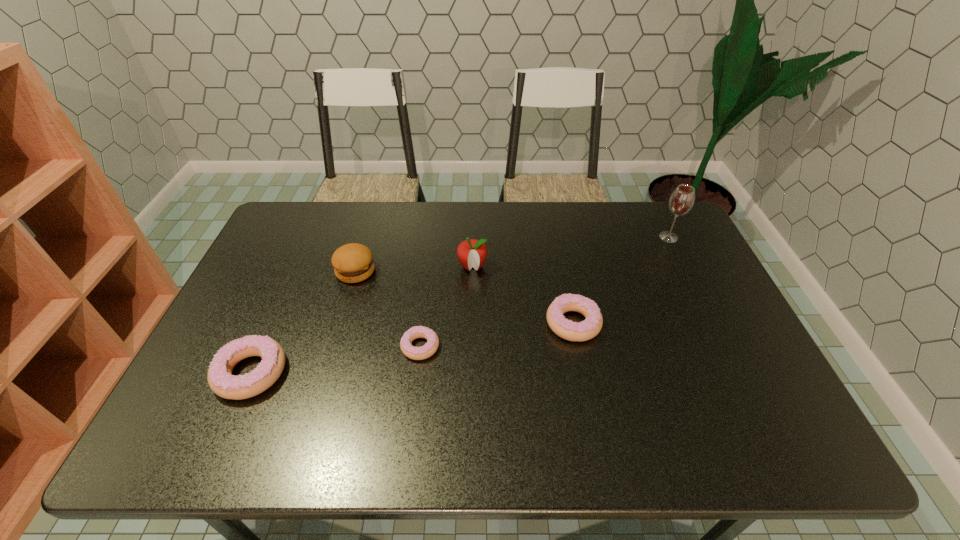
Locate an element on the screen. The width and height of the screenshot is (960, 540). free space between the fourth object from right to left and the fourth shortest object is located at coordinates (388, 309).

The image size is (960, 540). I want to click on free area in between the second shortest doughnut and the fifth shortest object, so click(x=523, y=295).

Find the location of a particular element. The width and height of the screenshot is (960, 540). vacant area that lies between the third object from left to right and the third object from right to left is located at coordinates (446, 306).

The height and width of the screenshot is (540, 960). Find the location of `vacant region between the shortest object and the farthest object`. vacant region between the shortest object and the farthest object is located at coordinates (544, 292).

Identify the location of free space between the second doughnut from left to right and the farthest object. This screenshot has width=960, height=540. (544, 292).

I want to click on the closest object to the fifth object from left to right, so click(x=471, y=253).

Identify which object is located as the third nearest to the second object from left to right. Please provide its 2D coordinates. Your answer should be formatted as a tuple, i.e. [(x, y)], where the tuple contains the x and y coordinates of a point satisfying the conditions above.

[(471, 253)]

Select which doughnut is the second closest to the leftmost doughnut. Please provide its 2D coordinates. Your answer should be formatted as a tuple, i.e. [(x, y)], where the tuple contains the x and y coordinates of a point satisfying the conditions above.

[(573, 331)]

Identify which doughnut is the second closest to the shortest doughnut. Please provide its 2D coordinates. Your answer should be formatted as a tuple, i.e. [(x, y)], where the tuple contains the x and y coordinates of a point satisfying the conditions above.

[(573, 331)]

This screenshot has width=960, height=540. I want to click on vacant region that satisfies the following two spatial constraints: 1. on the back side of the fifth tallest object; 2. on the right side of the third object from left to right, so click(x=423, y=323).